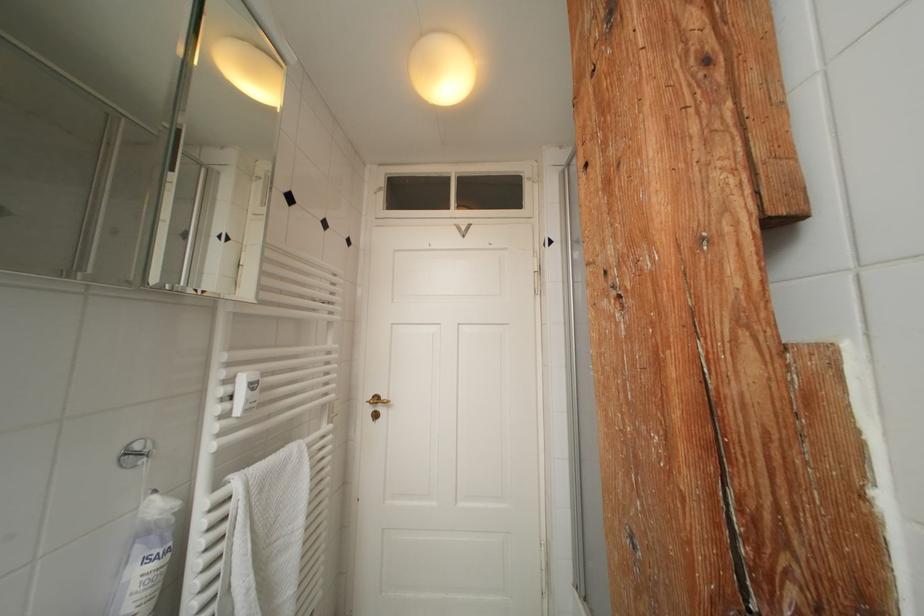
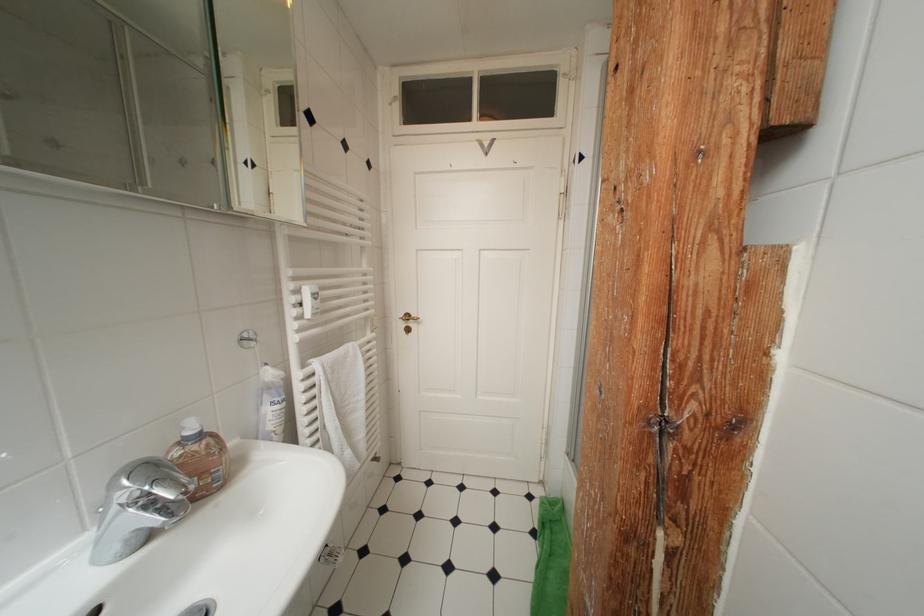
Question: What movement of the cameraman would produce the second image?

Choices:
 (A) Left
 (B) Right
 (C) Forward
 (D) Backward

Answer: (D)